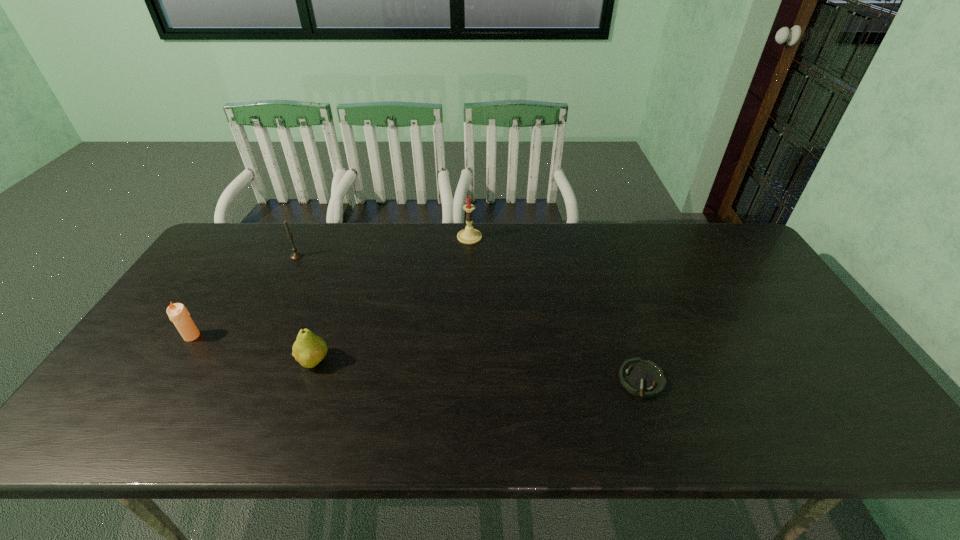
Identify the location of the farthest object. The width and height of the screenshot is (960, 540). (469, 235).

Image resolution: width=960 pixels, height=540 pixels. Find the location of `the fourth object from left to right`. the fourth object from left to right is located at coordinates (469, 235).

Where is `the second farthest candle`? the second farthest candle is located at coordinates (295, 255).

Find the location of a particular element. This screenshot has height=540, width=960. the second candle from right to left is located at coordinates (295, 255).

You are a GUI agent. You are given a task and a screenshot of the screen. Output one action in this format:
    pyautogui.click(x=<x>, y=<y>)
    Task: Click on the pear
    This screenshot has height=540, width=960.
    Given the screenshot: What is the action you would take?
    pyautogui.click(x=309, y=350)

The width and height of the screenshot is (960, 540). What are the coordinates of `the third farthest object` in the screenshot? It's located at (178, 314).

Where is `the nearest candle`? Image resolution: width=960 pixels, height=540 pixels. the nearest candle is located at coordinates (178, 314).

The width and height of the screenshot is (960, 540). I want to click on ashtray, so click(642, 378).

Where is `the shortest object`? Image resolution: width=960 pixels, height=540 pixels. the shortest object is located at coordinates (642, 378).

Identify the location of vacant region located on the left of the second object from right to left. The width and height of the screenshot is (960, 540). (393, 237).